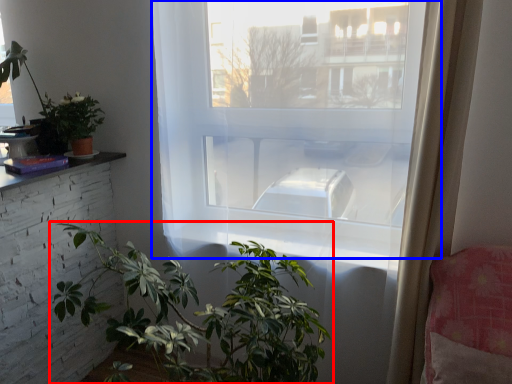
Question: Which point is closer to the camera, houseplant (highlighted by a red box) or window (highlighted by a blue box)?

Choices:
 (A) houseplant
 (B) window

Answer: (A)